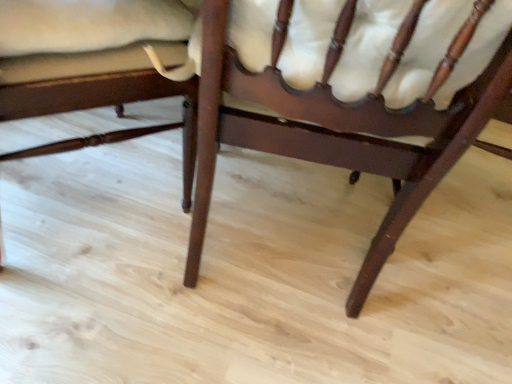
Question: In the image, is mahogany wood chair at center, arranged as the 1th chair when viewed from the right, on the left side or the right side of matte dark wood chair at lower left, the second chair viewed from the right?

Choices:
 (A) left
 (B) right

Answer: (B)

Question: Is mahogany wood chair at center, arranged as the 1th chair when viewed from the right, wider or thinner than matte dark wood chair at lower left, the second chair viewed from the right?

Choices:
 (A) thin
 (B) wide

Answer: (A)

Question: From a real-world perspective, is mahogany wood chair at center, the second chair in the left-to-right sequence, above or below matte dark wood chair at lower left, the second chair viewed from the right?

Choices:
 (A) below
 (B) above

Answer: (B)

Question: Choose the correct answer: Is matte dark wood chair at lower left, the second chair viewed from the right, inside mahogany wood chair at center, the second chair in the left-to-right sequence, or outside it?

Choices:
 (A) inside
 (B) outside

Answer: (B)

Question: Looking at their shapes, would you say matte dark wood chair at lower left, arranged as the 1th chair when viewed from the left, is wider or thinner than mahogany wood chair at center, arranged as the 1th chair when viewed from the right?

Choices:
 (A) wide
 (B) thin

Answer: (A)

Question: From the image's perspective, is matte dark wood chair at lower left, the second chair viewed from the right, positioned above or below mahogany wood chair at center, the second chair in the left-to-right sequence?

Choices:
 (A) below
 (B) above

Answer: (B)

Question: From a real-world perspective, is matte dark wood chair at lower left, arranged as the 1th chair when viewed from the left, physically located above or below mahogany wood chair at center, arranged as the 1th chair when viewed from the right?

Choices:
 (A) above
 (B) below

Answer: (B)